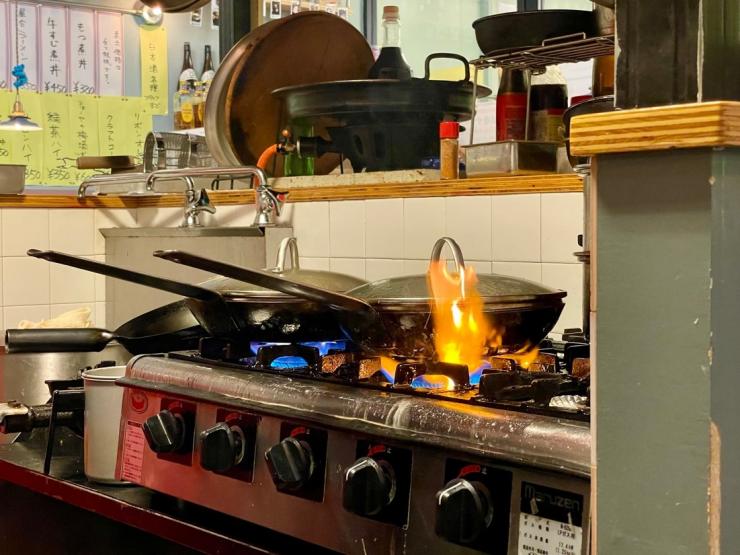
The width and height of the screenshot is (740, 555). I want to click on pans, so click(x=151, y=332), click(x=297, y=304), click(x=454, y=317), click(x=533, y=23), click(x=271, y=70).